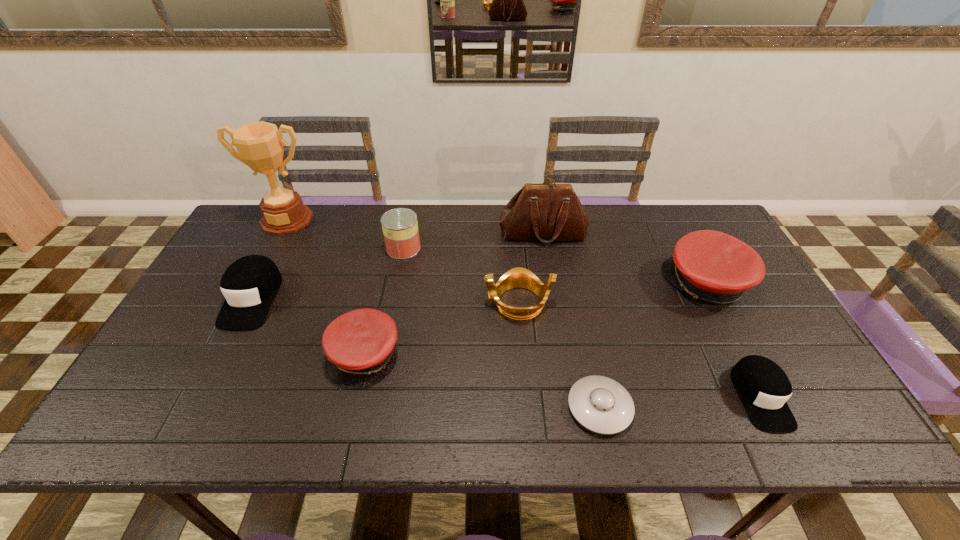
Locate an element on the screen. This screenshot has height=540, width=960. free space that is in between the second cap from left to right and the saucer is located at coordinates (482, 381).

This screenshot has width=960, height=540. In order to click on blank region between the tallest object and the tiara in this screenshot , I will do `click(402, 261)`.

I want to click on free space between the brown shoulder bag and the tiara, so pos(531,268).

Image resolution: width=960 pixels, height=540 pixels. Identify the location of vacant point located between the can and the farther red cap. (555, 266).

The height and width of the screenshot is (540, 960). Find the location of `empty space that is in between the left red cap and the left black cap`. empty space that is in between the left red cap and the left black cap is located at coordinates click(308, 326).

This screenshot has width=960, height=540. Find the location of `empty location between the tallest object and the smaller red cap`. empty location between the tallest object and the smaller red cap is located at coordinates (325, 287).

Where is `free space between the can and the tiara`? The height and width of the screenshot is (540, 960). free space between the can and the tiara is located at coordinates (461, 275).

The image size is (960, 540). In order to click on object that is the seventh nearest to the bigger red cap in this screenshot , I will do `click(259, 144)`.

What are the coordinates of `object that is the third closest to the leftmost cap` in the screenshot? It's located at (400, 227).

Locate which cap is the closest to the second cap from left to right. Please provide its 2D coordinates. Your answer should be formatted as a tuple, i.e. [(x, y)], where the tuple contains the x and y coordinates of a point satisfying the conditions above.

[(249, 285)]